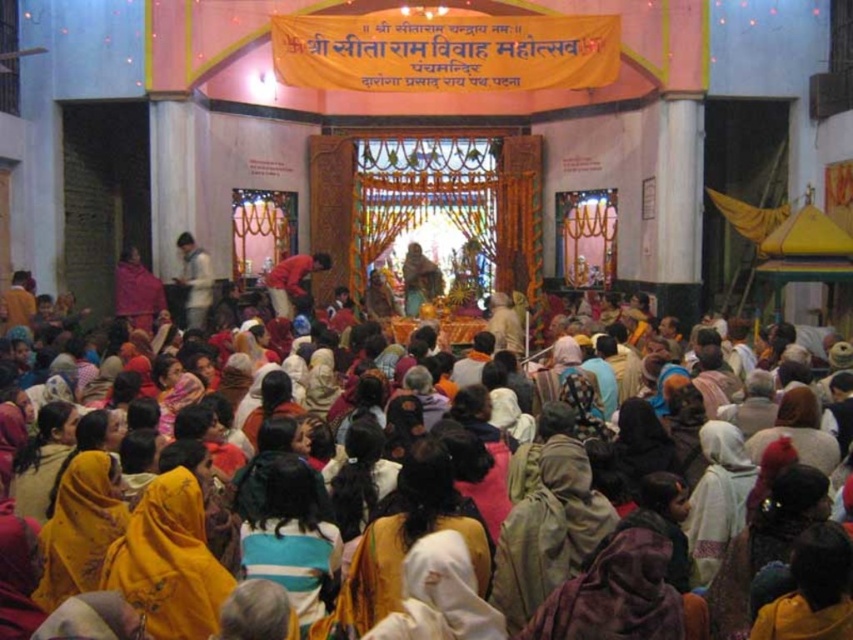
I want to click on yellow fabric at center, so click(x=757, y=486).

From the picture: Is yellow fabric at center to the left of red fabric cloth at center from the viewer's perspective?

No, yellow fabric at center is not to the left of red fabric cloth at center.

Locate an element on the screen. This screenshot has width=853, height=640. yellow fabric at center is located at coordinates (757, 486).

Is white matte shirt at center thinner than red fabric cloth at center?

Correct, white matte shirt at center's width is less than red fabric cloth at center's.

Who is more forward, (195,276) or (323,269)?

Point (195,276)

Find the location of a particular element. The width and height of the screenshot is (853, 640). white matte shirt at center is located at coordinates (194, 280).

Is the position of yellow fabric at center more distant than that of white matte shirt at center?

No, yellow fabric at center is in front of white matte shirt at center.

At what (x,y) coordinates should I click in order to perform the action: click on yellow fabric at center. Please return your answer as a coordinate pair (x, y). The height and width of the screenshot is (640, 853). Looking at the image, I should click on (757, 486).

Is point (750, 515) closer to viewer compared to point (189, 312)?

Yes, it is in front of point (189, 312).

I want to click on yellow fabric at center, so click(x=757, y=486).